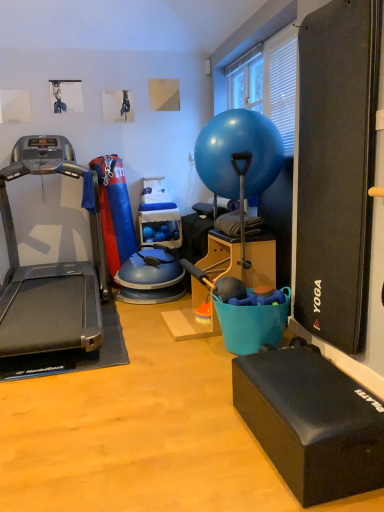
Question: From the image's perspective, would you say metallic gray treadmill at left is shown under black rubber yoga block at lower right, the 2th box in the back-to-front sequence?

Choices:
 (A) yes
 (B) no

Answer: (B)

Question: From a real-world perspective, does metallic gray treadmill at left sit lower than black rubber yoga block at lower right, the first box positioned from the front?

Choices:
 (A) no
 (B) yes

Answer: (A)

Question: Is metallic gray treadmill at left further to camera compared to black rubber yoga block at lower right, the 2th box positioned from the top?

Choices:
 (A) no
 (B) yes

Answer: (B)

Question: Is the position of metallic gray treadmill at left less distant than that of black rubber yoga block at lower right, the 2th box in the back-to-front sequence?

Choices:
 (A) no
 (B) yes

Answer: (A)

Question: Is black rubber yoga block at lower right, the first box when ordered from bottom to top, surrounded by metallic gray treadmill at left?

Choices:
 (A) yes
 (B) no

Answer: (B)

Question: From their relative heights in the image, would you say glossy rubber ball at center is taller or shorter than metallic gray treadmill at left?

Choices:
 (A) short
 (B) tall

Answer: (A)

Question: From a real-world perspective, is glossy rubber ball at center above or below metallic gray treadmill at left?

Choices:
 (A) below
 (B) above

Answer: (B)

Question: Based on their sizes in the image, would you say glossy rubber ball at center is bigger or smaller than metallic gray treadmill at left?

Choices:
 (A) big
 (B) small

Answer: (B)

Question: Is glossy rubber ball at center wider or thinner than metallic gray treadmill at left?

Choices:
 (A) thin
 (B) wide

Answer: (A)

Question: Is teal plastic bucket at center, positioned as the first box in top-to-bottom order, bigger or smaller than metallic gray treadmill at left?

Choices:
 (A) small
 (B) big

Answer: (A)

Question: From the image's perspective, relative to metallic gray treadmill at left, is teal plastic bucket at center, which is the 2th box in front-to-back order, above or below?

Choices:
 (A) below
 (B) above

Answer: (A)

Question: Is teal plastic bucket at center, which ranks as the first box in back-to-front order, spatially inside metallic gray treadmill at left, or outside of it?

Choices:
 (A) inside
 (B) outside

Answer: (B)

Question: Is teal plastic bucket at center, which is the 2th box in front-to-back order, in front of or behind metallic gray treadmill at left in the image?

Choices:
 (A) front
 (B) behind

Answer: (B)

Question: Is black rubber yoga block at lower right, the first box when ordered from bottom to top, in front of or behind metallic gray treadmill at left in the image?

Choices:
 (A) behind
 (B) front

Answer: (B)

Question: Considering the positions of black rubber yoga block at lower right, the first box when ordered from bottom to top, and metallic gray treadmill at left in the image, is black rubber yoga block at lower right, the first box when ordered from bottom to top, wider or thinner than metallic gray treadmill at left?

Choices:
 (A) thin
 (B) wide

Answer: (A)